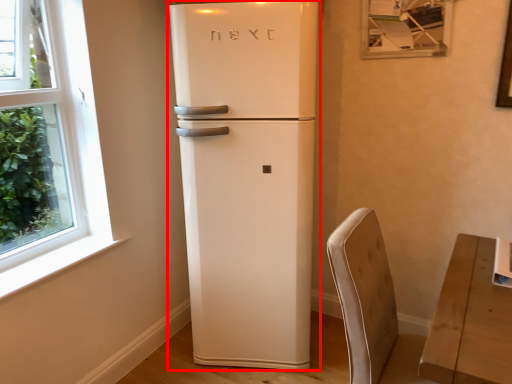
Question: From the image's perspective, where is refrigerator (annotated by the red box) located in relation to armchair in the image?

Choices:
 (A) below
 (B) above

Answer: (B)